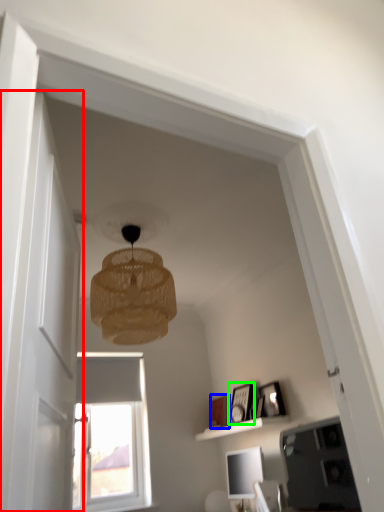
Question: Which is farther away from glass door (highlighted by a red box)? picture frame (highlighted by a blue box) or picture frame (highlighted by a green box)?

Choices:
 (A) picture frame
 (B) picture frame

Answer: (A)